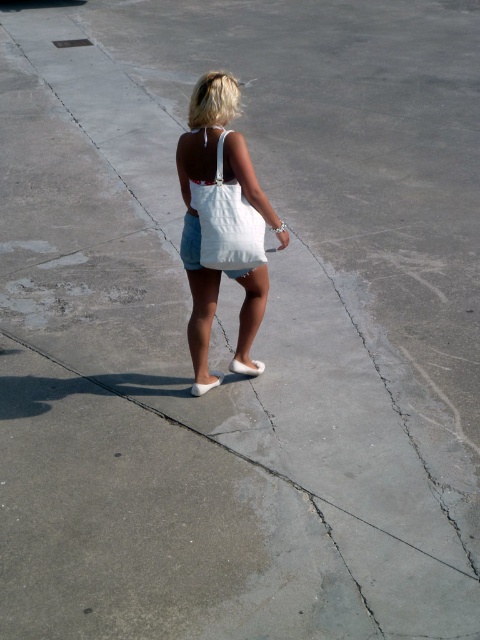
Who is more distant from viewer, (228, 221) or (201, 221)?

The point (201, 221) is behind.

Can you confirm if white canvas bag at center is taller than white canvas tote at upper center?

Yes, white canvas bag at center is taller than white canvas tote at upper center.

This screenshot has height=640, width=480. Find the location of `white canvas bag at center`. white canvas bag at center is located at coordinates tap(222, 218).

Identify the location of white canvas bag at center. (222, 218).

Who is lower down, white suede sandal at center or white suede sandal at lower center?

white suede sandal at lower center

What do you see at coordinates (247, 368) in the screenshot? The height and width of the screenshot is (640, 480). I see `white suede sandal at center` at bounding box center [247, 368].

You are a GUI agent. You are given a task and a screenshot of the screen. Output one action in this format:
    pyautogui.click(x=<x>, y=<y>)
    Task: Click on the white suede sandal at center
    The height and width of the screenshot is (640, 480).
    Given the screenshot: What is the action you would take?
    pyautogui.click(x=247, y=368)

Does white canvas tote at upper center have a lesser height compared to white suede sandal at lower center?

No, white canvas tote at upper center is not shorter than white suede sandal at lower center.

Locate an element on the screen. The width and height of the screenshot is (480, 640). white canvas tote at upper center is located at coordinates (227, 221).